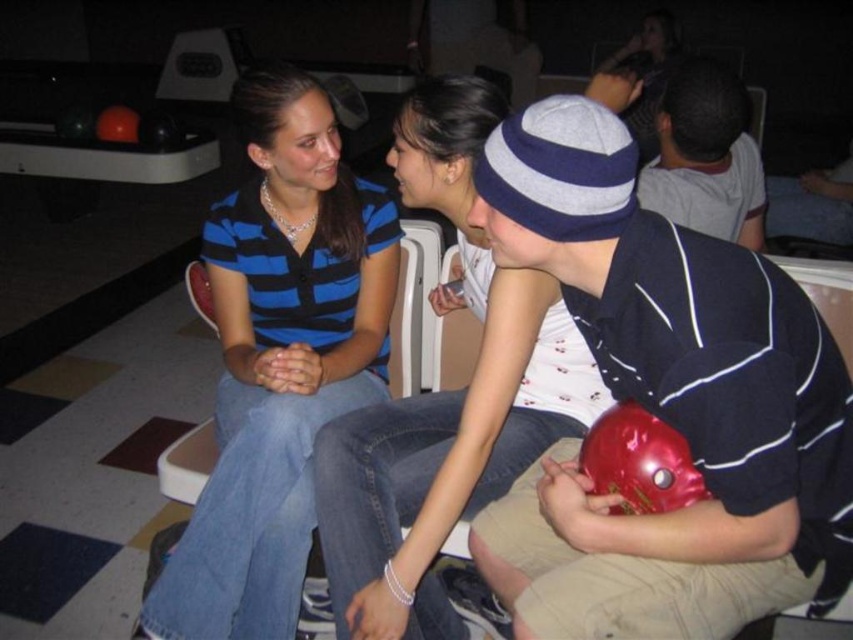
You are standing at the front of the image and see the shiny red bowling ball at center and the blue striped shirt at center. Which object is positioned more to the right?

The shiny red bowling ball at center is positioned to the right of the blue striped shirt at center, so it is more to the right.

You are a delivery robot with a 12 inch wide package. You need to place the package between the shiny red bowling ball at center and the matte blue shirt at center. Can you fit the package in that space?

The shiny red bowling ball at center and matte blue shirt at center are 10.85 inches apart from each other. Since the package is 12 inches wide, it cannot fit in the space between them.